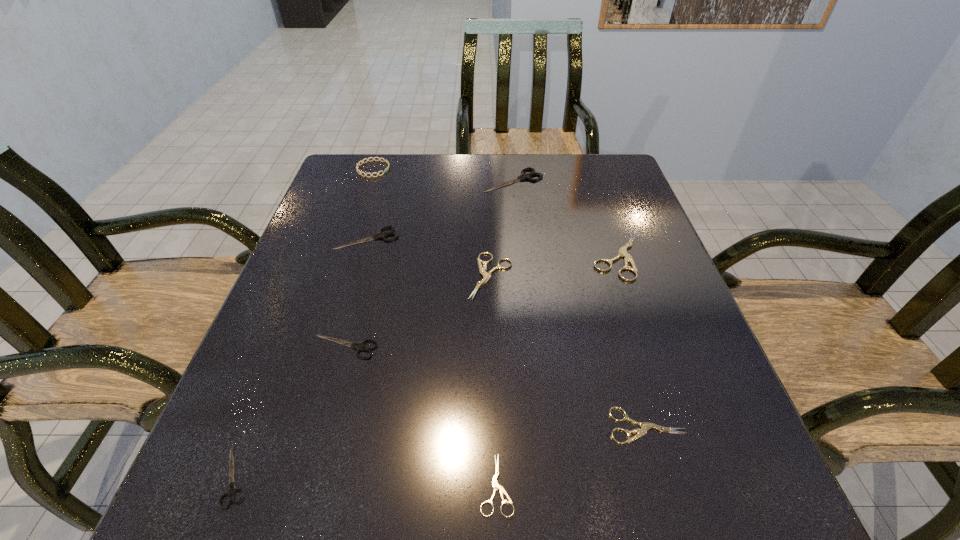
This screenshot has height=540, width=960. I want to click on free space between the farthest shears and the blue bracelet, so click(444, 175).

Locate an element on the screen. The image size is (960, 540). vacant area that lies between the third nearest shears and the fourth nearest shears is located at coordinates (495, 386).

In order to click on vacant area that lies between the second smallest beige shears and the shortest object in this screenshot , I will do `click(571, 455)`.

Where is `blank region between the bracelet and the third smallest beige shears`? blank region between the bracelet and the third smallest beige shears is located at coordinates (432, 222).

Point out which object is positioned as the fourth nearest to the biggest beige shears. Please provide its 2D coordinates. Your answer should be formatted as a tuple, i.e. [(x, y)], where the tuple contains the x and y coordinates of a point satisfying the conditions above.

[(496, 486)]

What are the coordinates of `object that ranks as the seventh closest to the third smallest beige shears` in the screenshot? It's located at point(379,159).

Locate which shears ranks sixth in proximity to the third smallest beige shears. Please provide its 2D coordinates. Your answer should be formatted as a tuple, i.e. [(x, y)], where the tuple contains the x and y coordinates of a point satisfying the conditions above.

[(496, 486)]

Locate an element on the screen. This screenshot has width=960, height=540. the sixth closest shears to the blue bracelet is located at coordinates (232, 490).

This screenshot has width=960, height=540. In order to click on black shears object that ranks as the fourth closest to the biggest beige shears in this screenshot , I will do `click(232, 490)`.

Find the location of `black shears that is the third closest one to the third farthest black shears`. black shears that is the third closest one to the third farthest black shears is located at coordinates (523, 176).